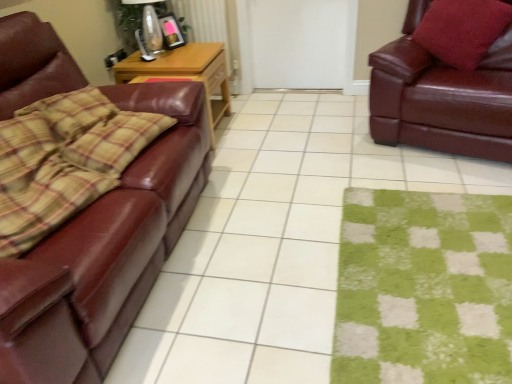
Question: From the image's perspective, relative to green fuzzy mat at lower right, is white matte door at center above or below?

Choices:
 (A) above
 (B) below

Answer: (A)

Question: Choose the correct answer: Is white matte door at center inside green fuzzy mat at lower right or outside it?

Choices:
 (A) inside
 (B) outside

Answer: (B)

Question: Estimate the real-world distances between objects in this image. Which object is closer to the woodenobject at left?

Choices:
 (A) velvet red pillow at upper right
 (B) matte glass lamp at upper center
 (C) white matte door at center
 (D) green fuzzy mat at lower right
 (E) shiny brown leather couch at left, marked as the 1th studio couch in a left-to-right arrangement

Answer: (B)

Question: Which object is the farthest from the shiny brown leather couch at right, acting as the 1th studio couch starting from the right?

Choices:
 (A) green fuzzy mat at lower right
 (B) matte brown leather couch at left
 (C) matte glass lamp at upper center
 (D) shiny brown leather couch at left, the 2th studio couch viewed from the right
 (E) metallic radiator at center

Answer: (C)